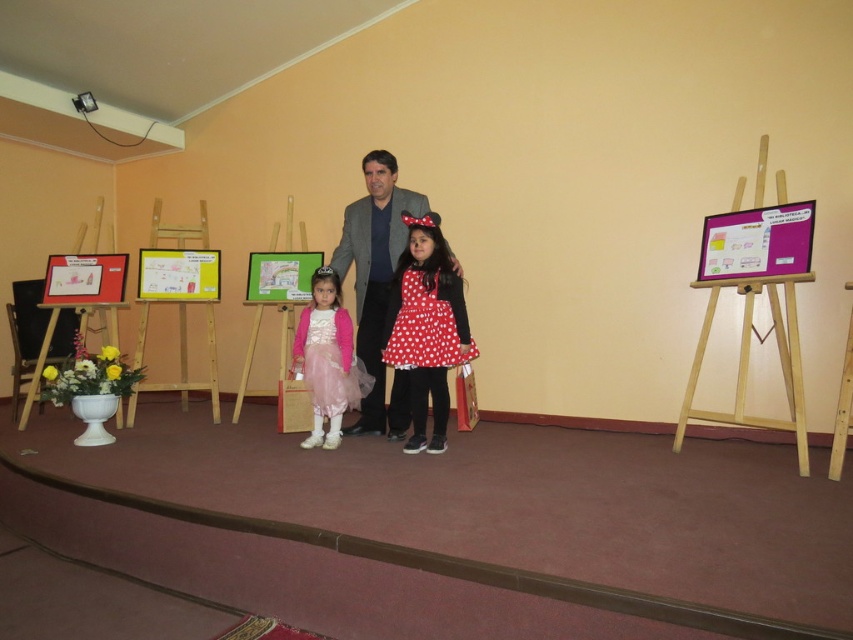
Question: Which is farther from the wooden easel at right?

Choices:
 (A) gray woolen suit at center
 (B) red polka dot dress at center

Answer: (A)

Question: Which point is closer to the camera?

Choices:
 (A) (451, 358)
 (B) (796, 381)
 (C) (347, 250)
 (D) (152, 227)

Answer: (B)

Question: Does wooden easel at left have a lesser width compared to pastel pink tulle dress at center?

Choices:
 (A) no
 (B) yes

Answer: (A)

Question: Which object is farther from the camera taking this photo?

Choices:
 (A) wooden easel at right
 (B) red polka dot dress at center
 (C) wooden easel at left
 (D) green matte board at center

Answer: (D)

Question: Does green matte board at center have a greater width compared to pastel pink tulle dress at center?

Choices:
 (A) no
 (B) yes

Answer: (B)

Question: From the image, what is the correct spatial relationship of red polka dot dress at center in relation to green matte board at center?

Choices:
 (A) right
 (B) left

Answer: (A)